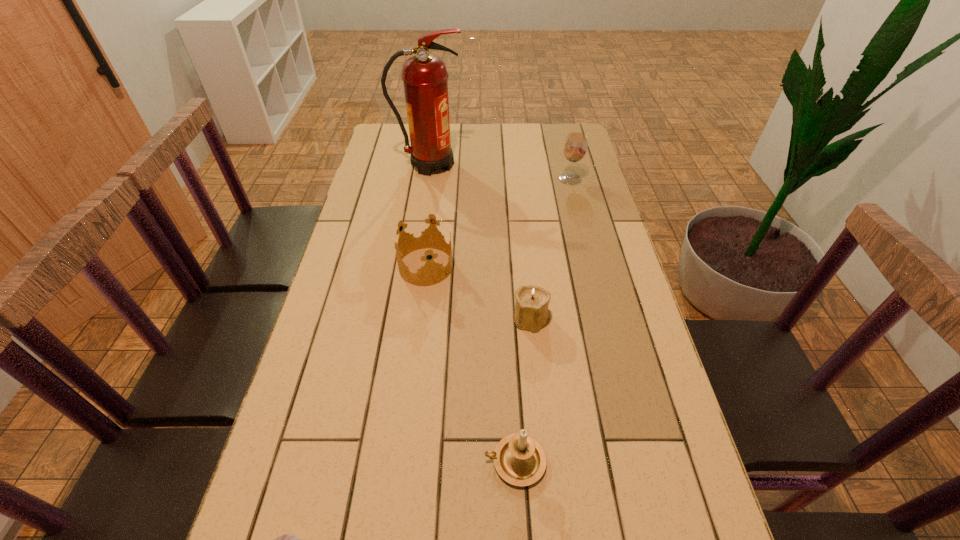
Where is `free space between the third nearest object and the crown`? The width and height of the screenshot is (960, 540). free space between the third nearest object and the crown is located at coordinates (479, 293).

Where is `free space between the crown and the fifth shortest object`? Image resolution: width=960 pixels, height=540 pixels. free space between the crown and the fifth shortest object is located at coordinates (498, 222).

Find the location of a particular element. unoccupied area between the farther candle_holder and the second tallest object is located at coordinates (551, 248).

Locate an element on the screen. free space that is in between the tallest object and the rightmost object is located at coordinates (500, 172).

At what (x,y) coordinates should I click in order to perform the action: click on free space between the fire extinguisher and the rightmost object. Please return your answer as a coordinate pair (x, y). Image resolution: width=960 pixels, height=540 pixels. Looking at the image, I should click on (500, 172).

Identify the location of vacant area that lies between the farther candle_holder and the wineglass. This screenshot has height=540, width=960. (551, 248).

Where is `free space between the third nearest object and the fire extinguisher`? The width and height of the screenshot is (960, 540). free space between the third nearest object and the fire extinguisher is located at coordinates (481, 241).

At what (x,y) coordinates should I click in order to perform the action: click on object that is the second closest to the rightmost object. Please return your answer as a coordinate pair (x, y). Looking at the image, I should click on (419, 231).

Where is `the closest object to the garlic`? This screenshot has width=960, height=540. the closest object to the garlic is located at coordinates (519, 459).

The height and width of the screenshot is (540, 960). I want to click on free spot that satisfies the following two spatial constraints: 1. on the front-facing side of the fire extinguisher; 2. on the back side of the rightmost object, so pos(428,179).